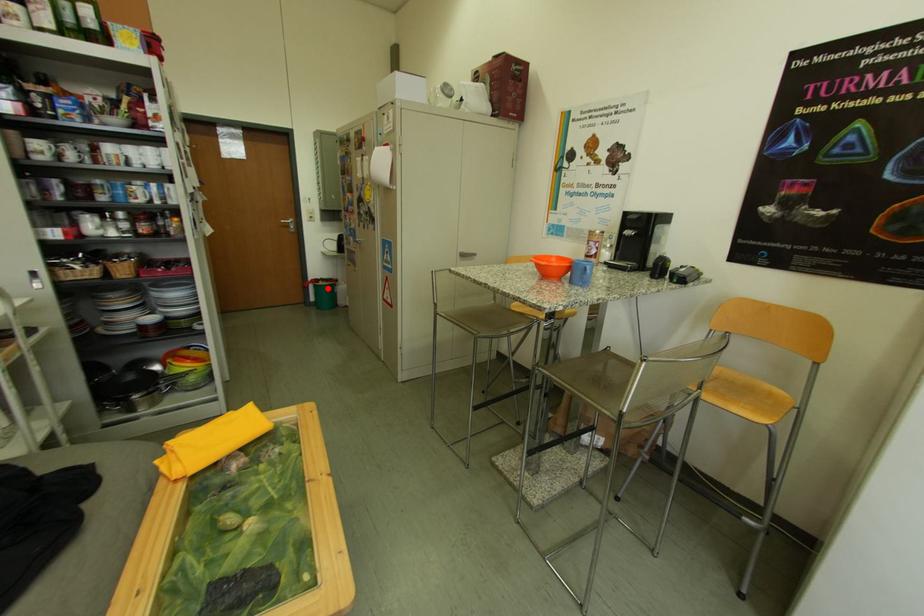
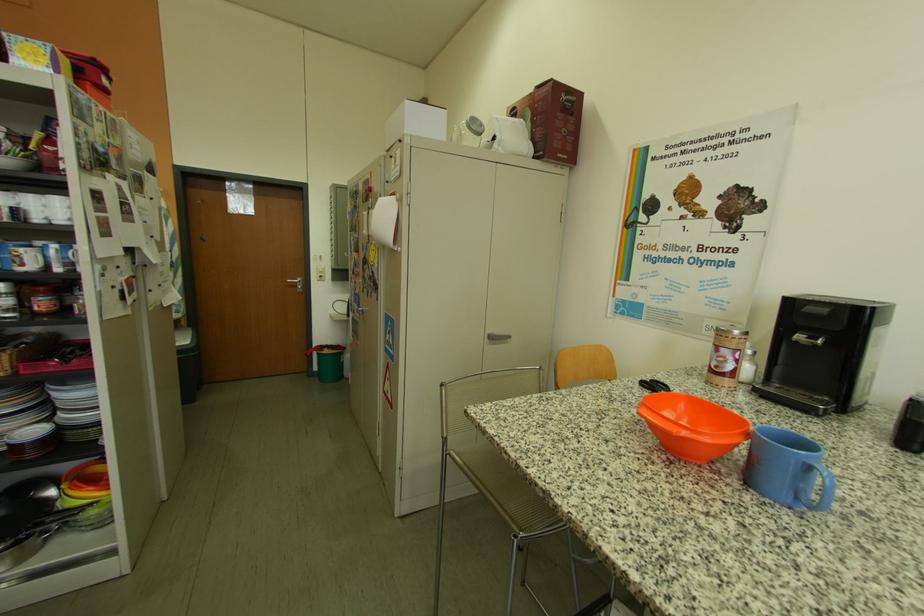
Question: I am providing you with two images of the same scene from different viewpoints. Image1 has a red point marked. In image2, the corresponding 3D location appears at what relative position? Reply with the corresponding letter.

Choices:
 (A) Closer
 (B) Farther

Answer: (A)